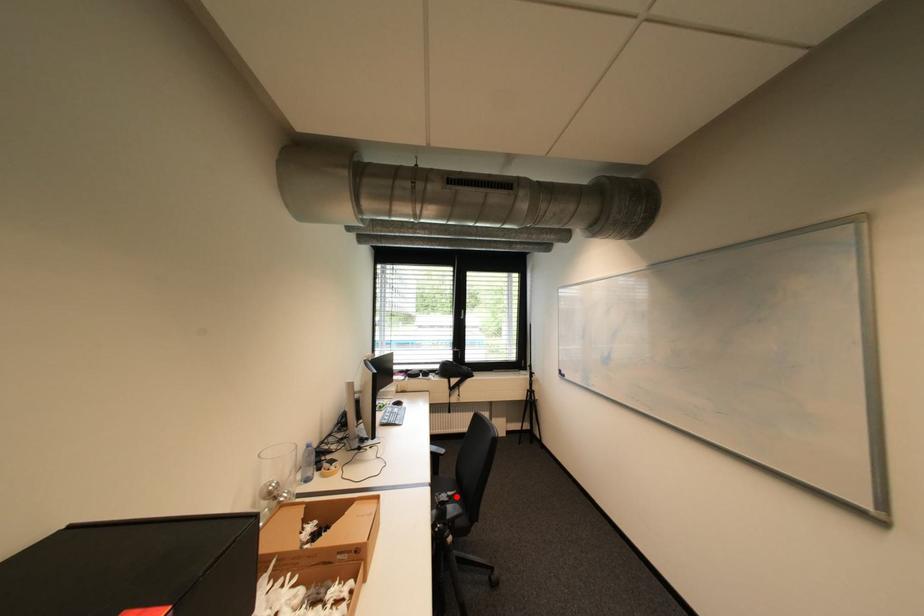
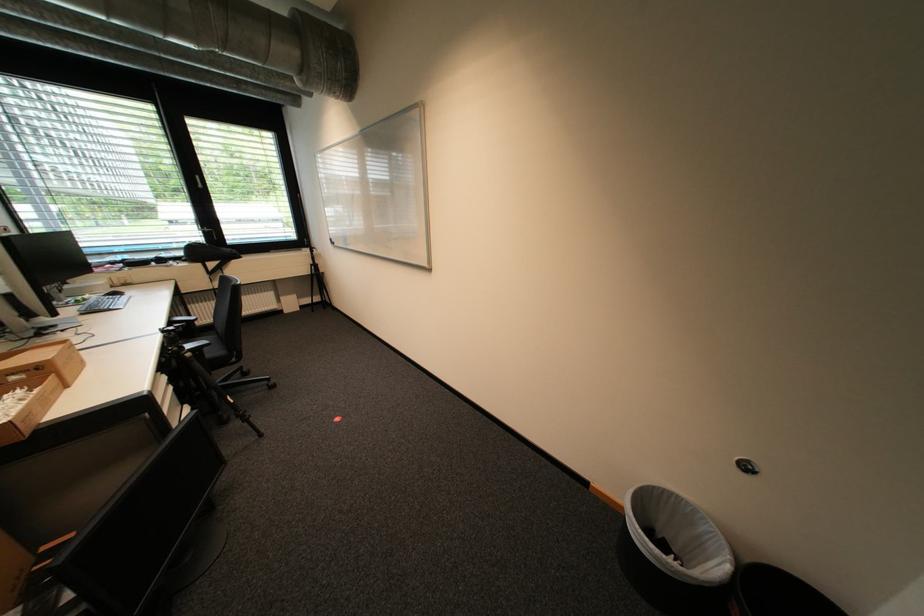
Question: I am providing you with two images of the same scene from different viewpoints. A red point is shown in image1. For the corresponding object point in image2, is it positioned nearer or farther from the camera?

Choices:
 (A) Nearer
 (B) Farther

Answer: (A)